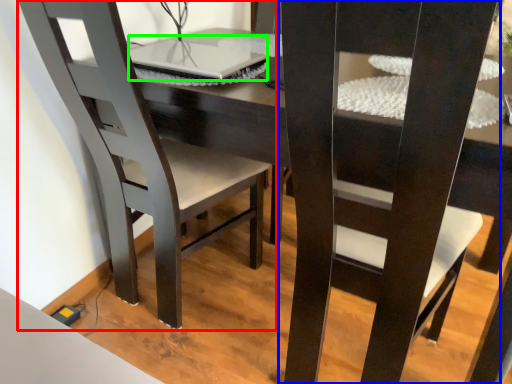
Question: Considering the real-world distances, which object is farthest from chair (highlighted by a red box)? chair (highlighted by a blue box) or laptop (highlighted by a green box)?

Choices:
 (A) chair
 (B) laptop

Answer: (A)